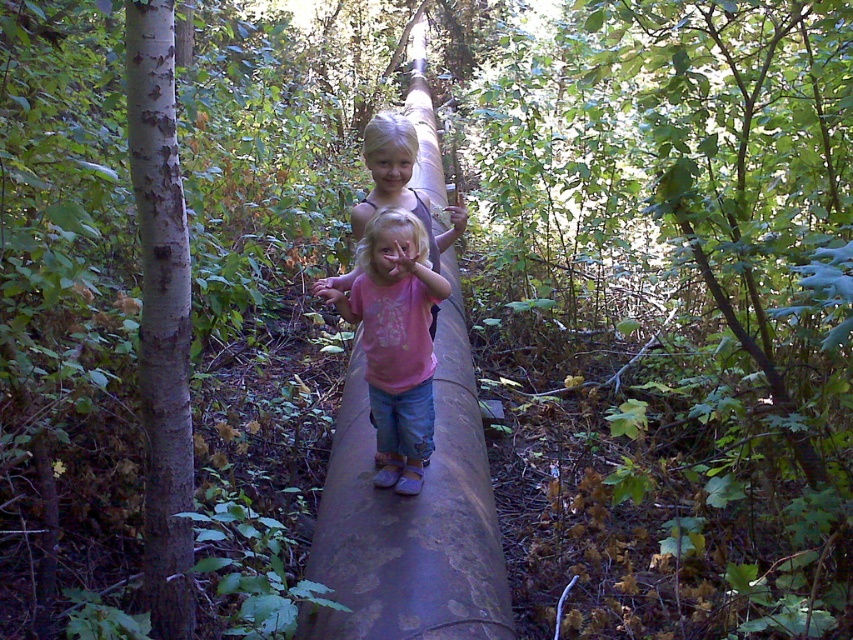
You are a hiker who wants to cross the pipe safely. You notice the white rough bark at left and the matte pink shirt at center. Which object should you avoid stepping on to maintain balance?

The white rough bark at left is thinner than the matte pink shirt at center. Therefore, you should avoid stepping on the white rough bark at left as it may not provide stable support.

Based on the photo, you are a hiker who wants to take a photo of the matte pink shirt at center and the white rough bark at left. From your current position, which object would appear closer in the photo?

The white rough bark at left would appear closer in the photo because it is in front of the matte pink shirt at center.

You are a hiker who wants to cross the forest using the old rusty pipe. There is a specific point marked at coordinates (412,518) on the pipe. What is located at this point?

The point at coordinates (412,518) indicates a rusty metal log at center, so there is a rusty metal log located at that position on the pipe.